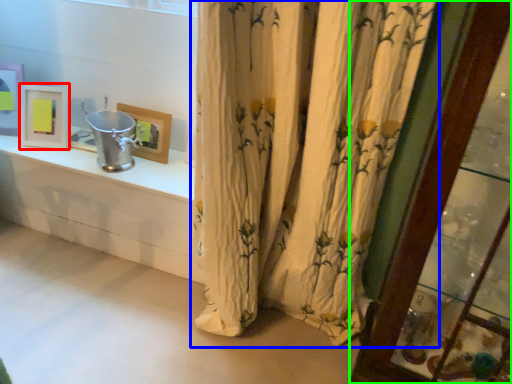
Question: Which is farther away from picture frame (highlighted by a red box)? curtain (highlighted by a blue box) or glass door (highlighted by a green box)?

Choices:
 (A) curtain
 (B) glass door

Answer: (B)